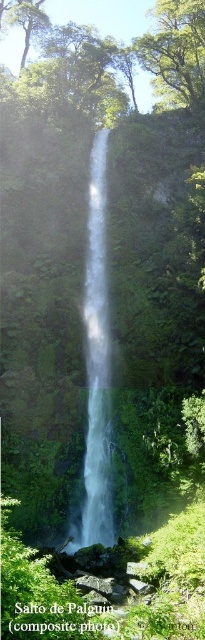
You are a hiker who just arrived at the waterfall. You want to take a photo of the clear glass waterfall at center from a safe distance. What is the minimum distance you should maintain to ensure you can capture the entire waterfall in one frame?

The minimum distance you should maintain is 14.52 meters to ensure the entire clear glass waterfall at center is captured in one frame.

In the scene shown: You are a hiker who wants to take a photo of the clear glass waterfall at center and the green leafy tree at upper center. Which object should you focus on first if you want to capture both in one shot?

You should focus on the green leafy tree at upper center first because the clear glass waterfall at center is located below it, allowing you to frame the shot starting from the tree and moving downward to include the waterfall.

You are a drone operator planning to fly a drone between the clear glass waterfall at center and the green leafy tree at upper center. The drone has a maximum flight distance of 30 feet. Can the drone safely make the trip between them without exceeding its limit?

The clear glass waterfall at center and green leafy tree at upper center are 35.33 feet apart from each other. Since the drone can only fly up to 30 feet, it cannot safely make the trip between them without exceeding its limit.